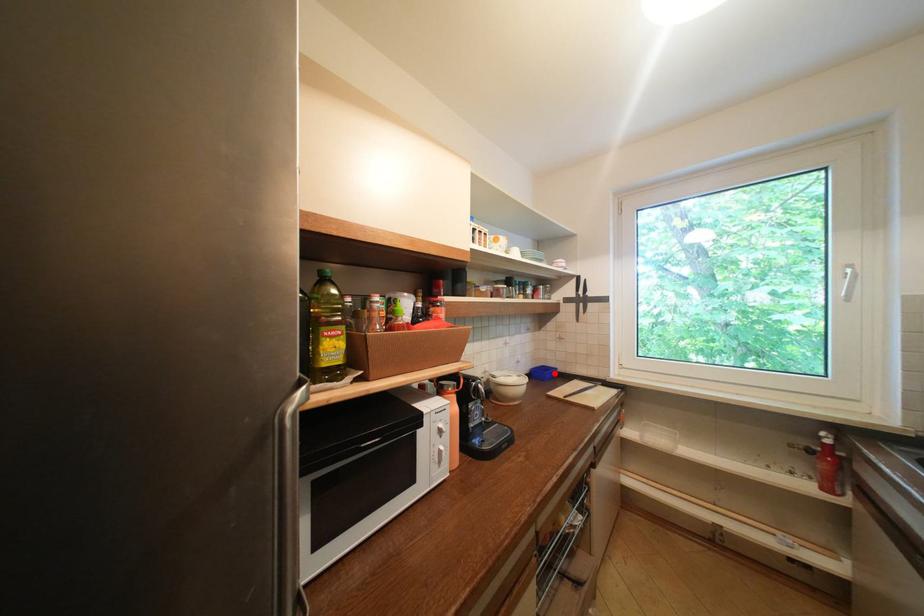
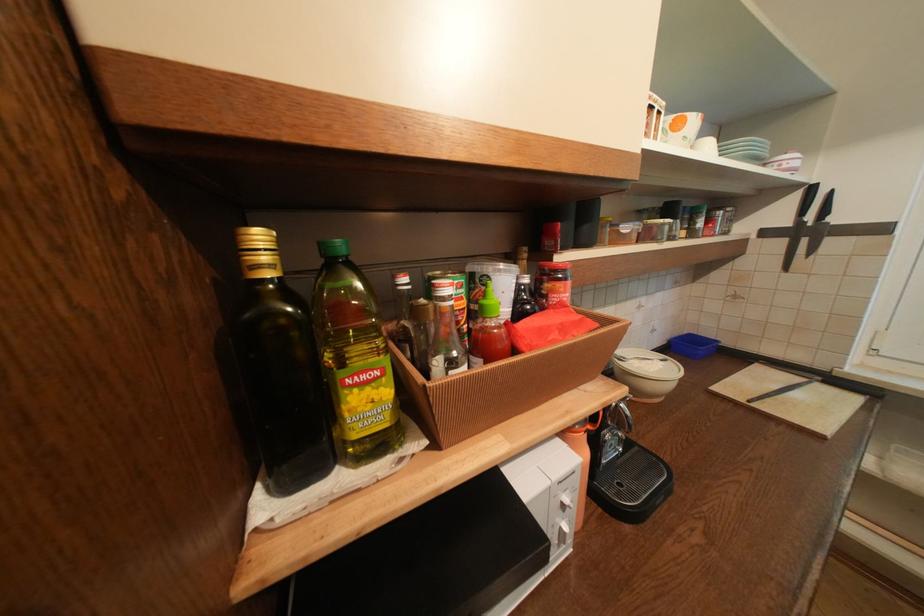
Where in the second image is the point corresponding to the highlighted location from the first image?

(709, 349)